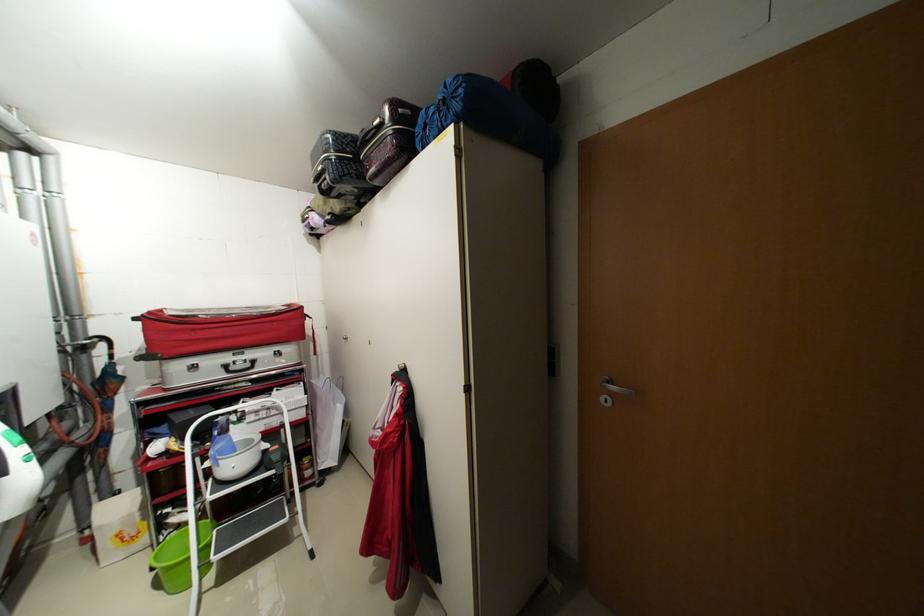
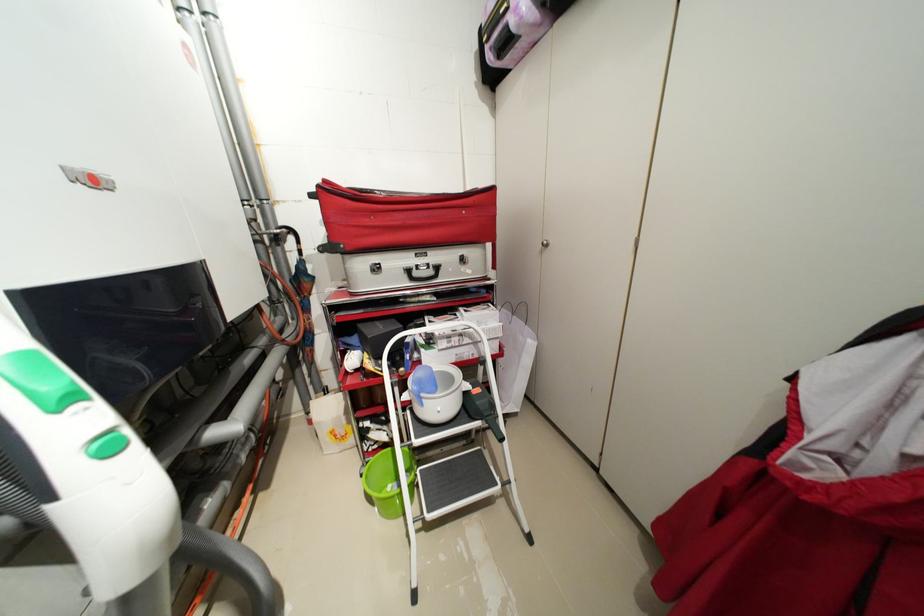
Locate, in the second image, the point that corresponds to (x=239, y=369) in the first image.

(422, 275)